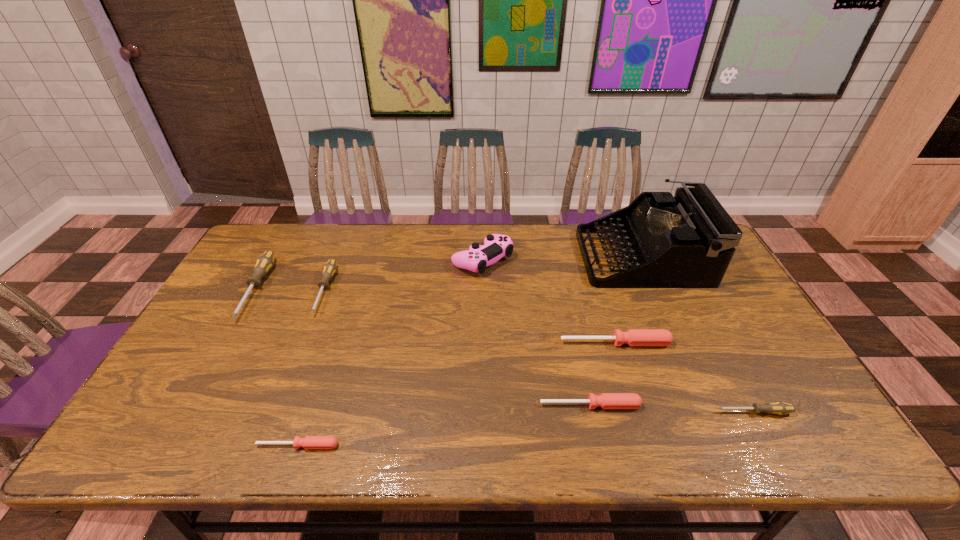
This screenshot has width=960, height=540. Identify the location of the rightmost screwdriver. (780, 408).

The height and width of the screenshot is (540, 960). In order to click on the rightmost gray screwdriver in this screenshot , I will do `click(780, 408)`.

Locate an element on the screen. the nearest red screwdriver is located at coordinates (309, 442).

The height and width of the screenshot is (540, 960). What are the coordinates of `the nearest screwdriver` in the screenshot? It's located at (309, 442).

You are a GUI agent. You are given a task and a screenshot of the screen. Output one action in this format:
    pyautogui.click(x=<x>, y=<y>)
    Task: Click on the vacant space located 0.200m on the typing side of the tallest object
    This screenshot has height=540, width=960.
    Given the screenshot: What is the action you would take?
    pyautogui.click(x=522, y=256)

This screenshot has height=540, width=960. Find the location of `vacant point located 0.160m on the typing side of the tallest object`. vacant point located 0.160m on the typing side of the tallest object is located at coordinates (535, 256).

Image resolution: width=960 pixels, height=540 pixels. What are the coordinates of `vacant space located on the typing side of the tallest object` in the screenshot? It's located at (540, 256).

Find the location of a particular element. This screenshot has height=540, width=960. vacant position located 0.260m on the front of the fourth object from left to right is located at coordinates (483, 342).

The image size is (960, 540). I want to click on vacant space positioned at the tip of the biggest gray screwdriver, so click(x=224, y=347).

Identify the location of vacant area situated 0.330m at the tip of the second biggest gray screwdriver. (274, 421).